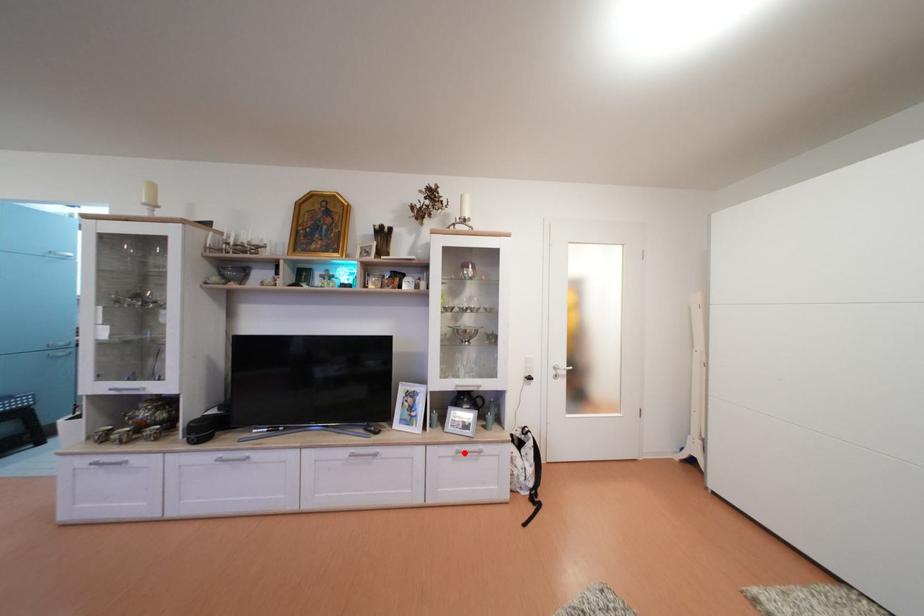
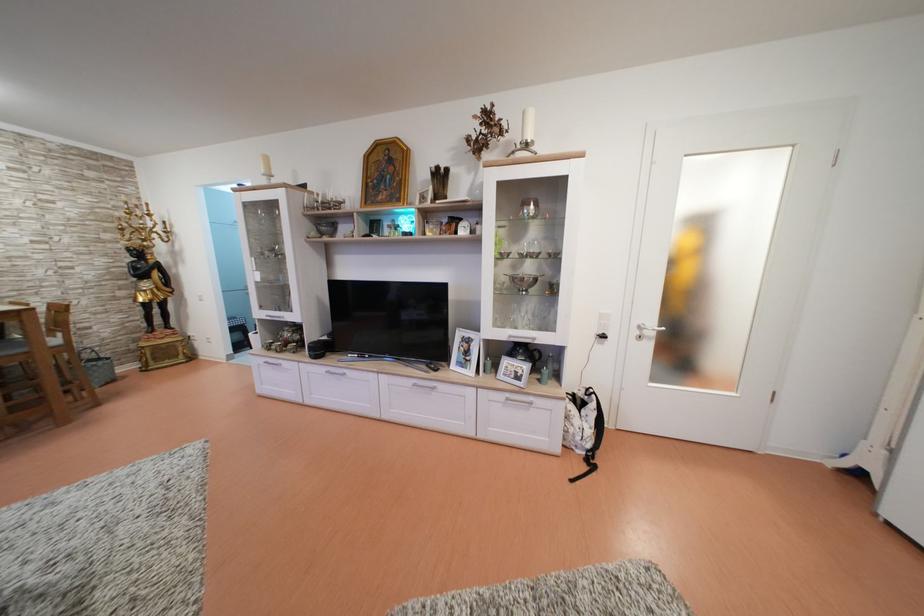
In the second image, find the point that corresponds to the highlighted location in the first image.

(515, 400)